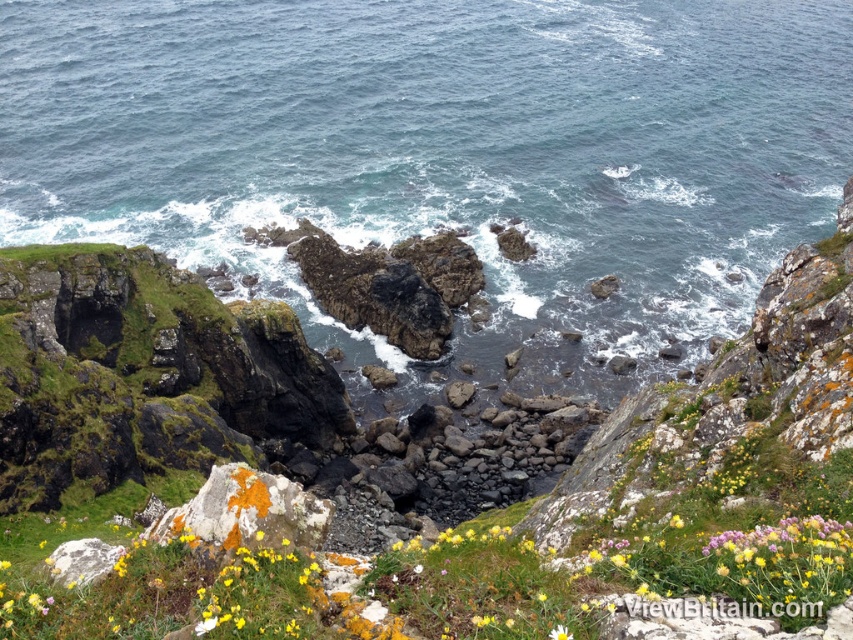
Question: Does blue water at center have a lesser width compared to speckled gray rock at lower left?

Choices:
 (A) yes
 (B) no

Answer: (B)

Question: Which is farther from the blue water at center?

Choices:
 (A) white matte flower at center
 (B) speckled gray rock at lower left

Answer: (A)

Question: Does blue water at center appear on the left side of white matte flower at center?

Choices:
 (A) no
 (B) yes

Answer: (B)

Question: Which point appears closest to the camera in this image?

Choices:
 (A) (59, 572)
 (B) (840, 38)
 (C) (553, 634)

Answer: (C)

Question: Is blue water at center to the left of speckled gray rock at lower left from the viewer's perspective?

Choices:
 (A) no
 (B) yes

Answer: (B)

Question: Among these points, which one is nearest to the camera?

Choices:
 (A) (555, 628)
 (B) (91, 74)

Answer: (A)